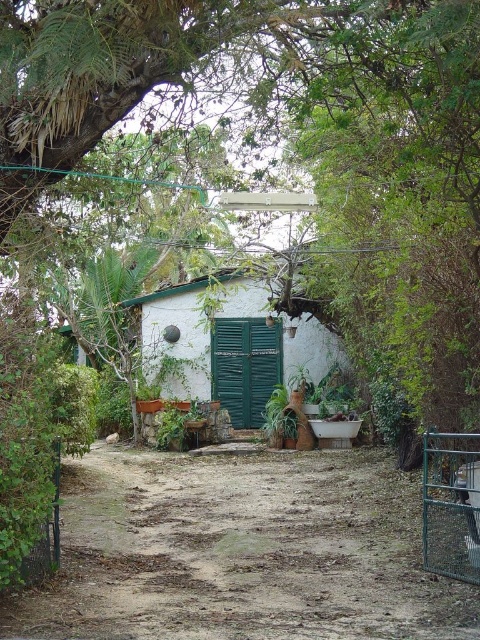
Question: In this image, where is dirt ground at center located relative to green metal gate at lower right?

Choices:
 (A) below
 (B) above

Answer: (A)

Question: Estimate the real-world distances between objects in this image. Which object is farther from the dirt ground at center?

Choices:
 (A) white stucco hut at center
 (B) metallic wire fence at lower left
 (C) green metal gate at lower right

Answer: (A)

Question: Does dirt ground at center appear over white stucco hut at center?

Choices:
 (A) yes
 (B) no

Answer: (B)

Question: Does dirt ground at center have a smaller size compared to green metal gate at lower right?

Choices:
 (A) yes
 (B) no

Answer: (B)

Question: Which of the following is the closest to the observer?

Choices:
 (A) (55, 548)
 (B) (437, 442)

Answer: (A)

Question: Which point appears closest to the camera in this image?

Choices:
 (A) (23, 552)
 (B) (444, 502)
 (C) (20, 604)

Answer: (A)